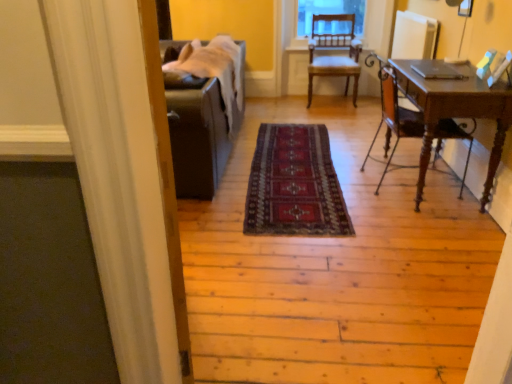
Locate an element on the screen. This screenshot has height=384, width=512. free space in front of mahogany wood desk at right, the first chair positioned from the front is located at coordinates (415, 219).